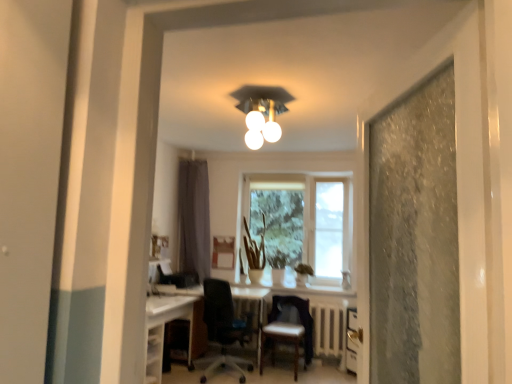
Question: Is gray fabric curtain at center outside white glossy light fixture at upper center?

Choices:
 (A) no
 (B) yes

Answer: (B)

Question: Does gray fabric curtain at center contain white glossy light fixture at upper center?

Choices:
 (A) no
 (B) yes

Answer: (A)

Question: Can you confirm if gray fabric curtain at center is positioned to the left of white glossy light fixture at upper center?

Choices:
 (A) yes
 (B) no

Answer: (A)

Question: Considering the relative sizes of gray fabric curtain at center and white glossy light fixture at upper center in the image provided, is gray fabric curtain at center taller than white glossy light fixture at upper center?

Choices:
 (A) yes
 (B) no

Answer: (A)

Question: Is gray fabric curtain at center far away from white glossy light fixture at upper center?

Choices:
 (A) no
 (B) yes

Answer: (B)

Question: From the image's perspective, is gray fabric curtain at center on top of white glossy light fixture at upper center?

Choices:
 (A) yes
 (B) no

Answer: (B)

Question: Does white glossy computer desk at lower left have a greater width compared to transparent glass window at center?

Choices:
 (A) yes
 (B) no

Answer: (A)

Question: Considering the relative sizes of white glossy computer desk at lower left and transparent glass window at center in the image provided, is white glossy computer desk at lower left shorter than transparent glass window at center?

Choices:
 (A) yes
 (B) no

Answer: (A)

Question: Is white glossy computer desk at lower left outside of transparent glass window at center?

Choices:
 (A) yes
 (B) no

Answer: (A)

Question: Does white glossy computer desk at lower left have a smaller size compared to transparent glass window at center?

Choices:
 (A) yes
 (B) no

Answer: (A)

Question: Is white glossy computer desk at lower left closer to camera compared to transparent glass window at center?

Choices:
 (A) no
 (B) yes

Answer: (B)

Question: Considering the relative sizes of white glossy computer desk at lower left and transparent glass window at center in the image provided, is white glossy computer desk at lower left taller than transparent glass window at center?

Choices:
 (A) yes
 (B) no

Answer: (B)

Question: Is the position of white glossy computer desk at lower left more distant than that of leather-like brown chair at center, which is the 2th chair in left-to-right order?

Choices:
 (A) yes
 (B) no

Answer: (A)